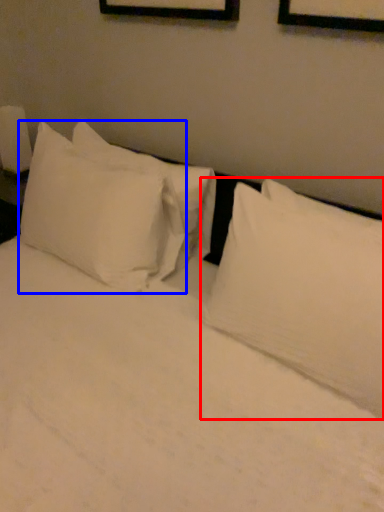
Question: Which object appears farthest to the camera in this image, pillow (highlighted by a red box) or pillow (highlighted by a blue box)?

Choices:
 (A) pillow
 (B) pillow

Answer: (B)